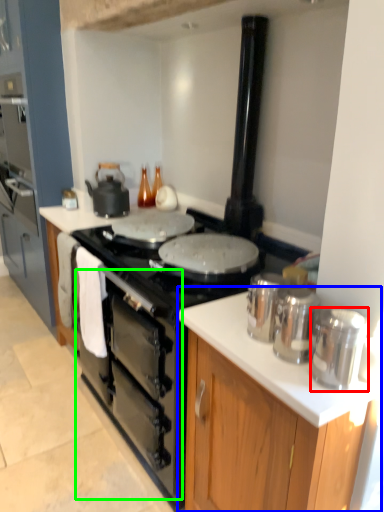
Question: Estimate the real-world distances between objects in this image. Which object is farther from kitchen appliance (highlighted by a red box), cabinetry (highlighted by a blue box) or oven (highlighted by a green box)?

Choices:
 (A) cabinetry
 (B) oven

Answer: (B)